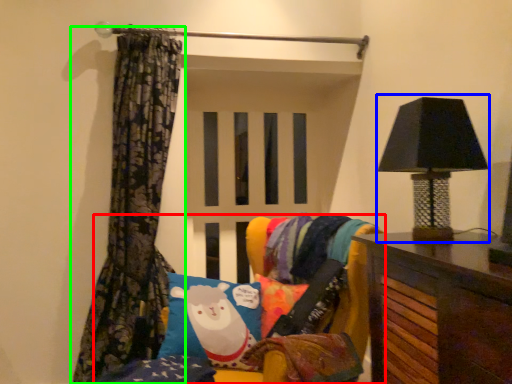
Question: Considering the real-world distances, which object is farthest from furniture (highlighted by a red box)? table lamp (highlighted by a blue box) or curtain (highlighted by a green box)?

Choices:
 (A) table lamp
 (B) curtain

Answer: (B)